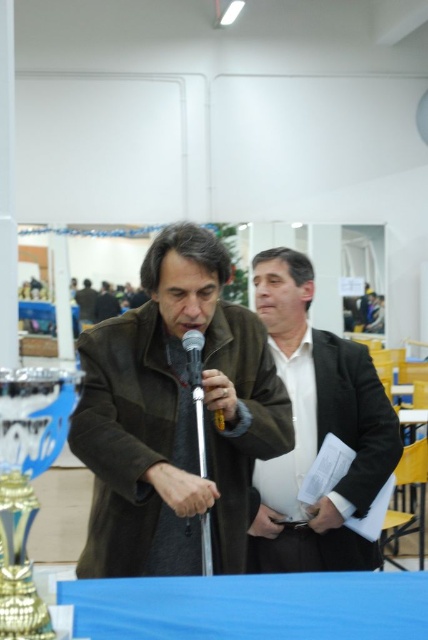
Question: Can you confirm if matte black suit at center is positioned below silver metallic microphone at center?

Choices:
 (A) no
 (B) yes

Answer: (B)

Question: Does matte black suit at center appear on the right side of silver metallic microphone at center?

Choices:
 (A) yes
 (B) no

Answer: (A)

Question: Which object is farther from the camera taking this photo?

Choices:
 (A) gold metallic trophy at lower left
 (B) silver metallic microphone at center
 (C) matte black suit at center

Answer: (C)

Question: From the image, what is the correct spatial relationship of matte black suit at center in relation to silver metallic microphone at center?

Choices:
 (A) above
 (B) below

Answer: (B)

Question: Which of these objects is positioned closest to the gold metallic trophy at lower left?

Choices:
 (A) brown leather jacket at center
 (B) matte black suit at center

Answer: (A)

Question: Based on their relative distances, which object is nearer to the silver metallic microphone at center?

Choices:
 (A) matte black suit at center
 (B) gold metallic trophy at lower left
 (C) brown leather jacket at center

Answer: (C)